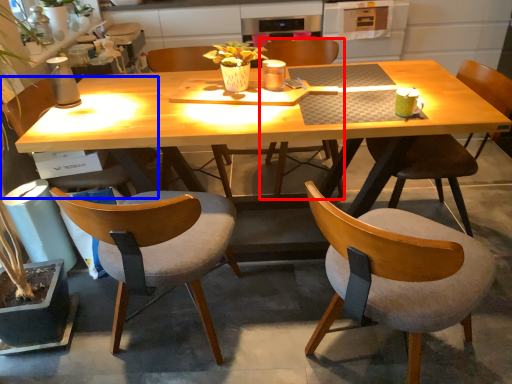
Question: Which object is closer to the camera taking this photo, chair (highlighted by a red box) or chair (highlighted by a blue box)?

Choices:
 (A) chair
 (B) chair

Answer: (B)